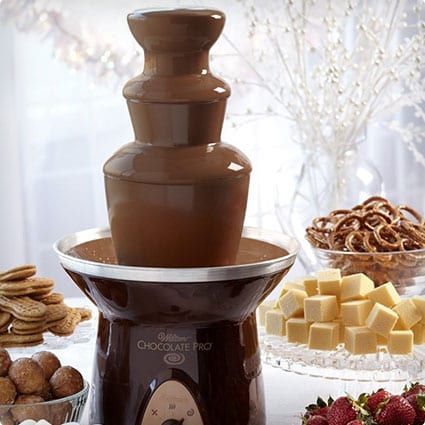
Where is `platter of biscuits`? The image size is (425, 425). platter of biscuits is located at coordinates (55, 339).